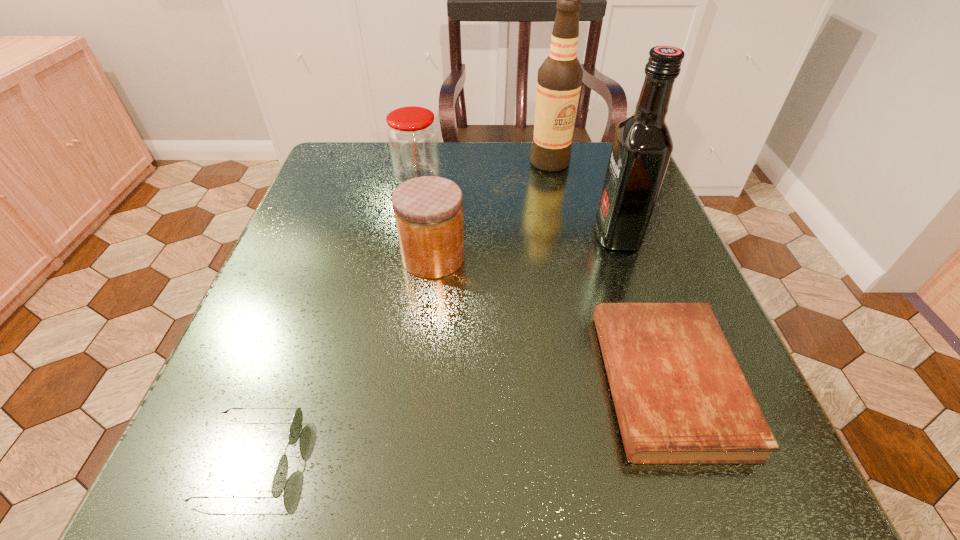
Where is `alcohol`? The width and height of the screenshot is (960, 540). alcohol is located at coordinates (559, 80).

The height and width of the screenshot is (540, 960). Find the location of `liquor`. liquor is located at coordinates (642, 147).

At what (x,y) coordinates should I click in order to perform the action: click on the farther jar. Please return your answer as a coordinate pair (x, y). Looking at the image, I should click on (412, 137).

Identify the location of the nearer jar. (428, 210).

Where is `Bible`? Bible is located at coordinates (680, 396).

Image resolution: width=960 pixels, height=540 pixels. I want to click on the leftmost object, so click(279, 481).

The width and height of the screenshot is (960, 540). Find the location of `vacant space located on the label of the alcohol`. vacant space located on the label of the alcohol is located at coordinates (580, 301).

I want to click on free space located on the front-facing side of the liquor, so click(433, 235).

You are a GUI agent. You are given a task and a screenshot of the screen. Output one action in this format:
    pyautogui.click(x=<x>, y=<y>)
    Task: Click on the free space located 0.130m on the front-facing side of the liquor
    The height and width of the screenshot is (540, 960).
    Given the screenshot: What is the action you would take?
    pyautogui.click(x=529, y=235)

Image resolution: width=960 pixels, height=540 pixels. Identify the location of blank space located 0.260m on the front-facing side of the liquor. (463, 235).